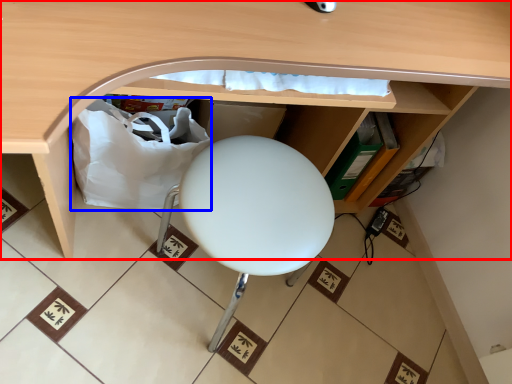
Question: Among these objects, which one is farthest to the camera, desk (highlighted by a red box) or paper bag (highlighted by a blue box)?

Choices:
 (A) desk
 (B) paper bag

Answer: (B)